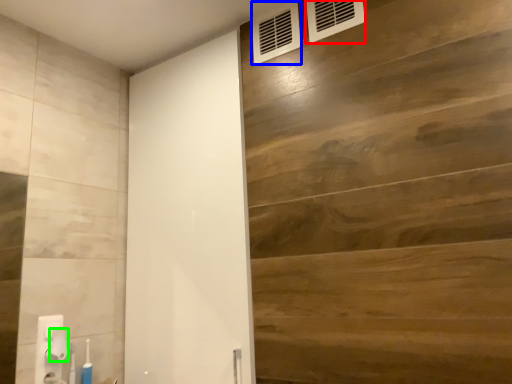
Question: Which object is positioned farthest from air conditioning (highlighted by a red box)? Select from air conditioning (highlighted by a blue box) and towel bar (highlighted by a green box).

Choices:
 (A) air conditioning
 (B) towel bar

Answer: (B)